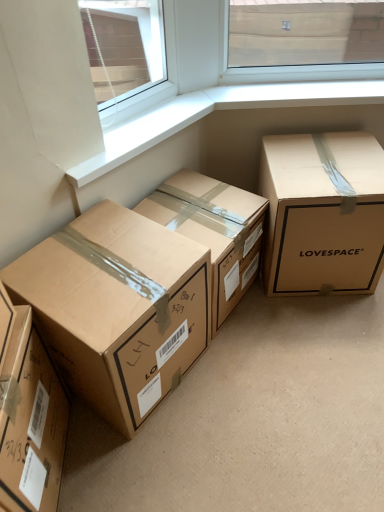
This screenshot has width=384, height=512. In order to click on free point above brown cardboard box at lower left, which ranks as the second box in left-to-right order (from a real-world perspective) in this screenshot , I will do `click(97, 261)`.